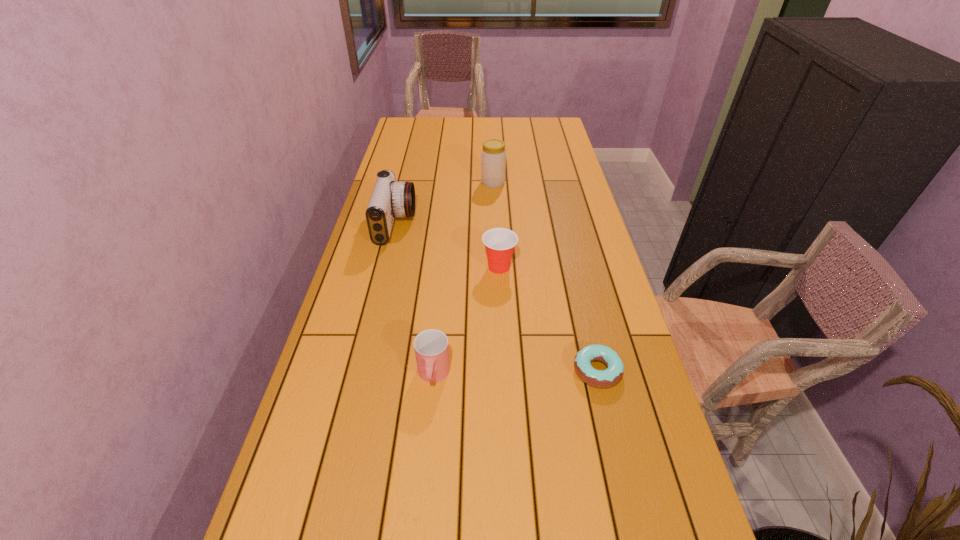
Where is `the farthest object`? This screenshot has height=540, width=960. the farthest object is located at coordinates (493, 157).

What are the coordinates of `the fourth nearest object` in the screenshot? It's located at (x=389, y=199).

At what (x,y) coordinates should I click in order to perform the action: click on the leftmost object. Please return your answer as a coordinate pair (x, y). The image size is (960, 540). Looking at the image, I should click on (389, 199).

At what (x,y) coordinates should I click in order to perform the action: click on the right cup. Please return your answer as a coordinate pair (x, y). The height and width of the screenshot is (540, 960). Looking at the image, I should click on coord(499,242).

This screenshot has height=540, width=960. I want to click on the third farthest object, so click(x=499, y=242).

Locate an element on the screen. The image size is (960, 540). the fourth object from right to left is located at coordinates (431, 347).

You are a GUI agent. You are given a task and a screenshot of the screen. Output one action in this format:
    pyautogui.click(x=<x>, y=<y>)
    Task: Click on the nearer cup
    The height and width of the screenshot is (540, 960).
    Given the screenshot: What is the action you would take?
    pyautogui.click(x=431, y=347)

Identify the location of doughnut. The image size is (960, 540). (606, 378).

Where is `the shortest object`? Image resolution: width=960 pixels, height=540 pixels. the shortest object is located at coordinates (606, 378).

Where is `free space located 0.370m on the back of the jar`? This screenshot has width=960, height=540. free space located 0.370m on the back of the jar is located at coordinates (492, 137).